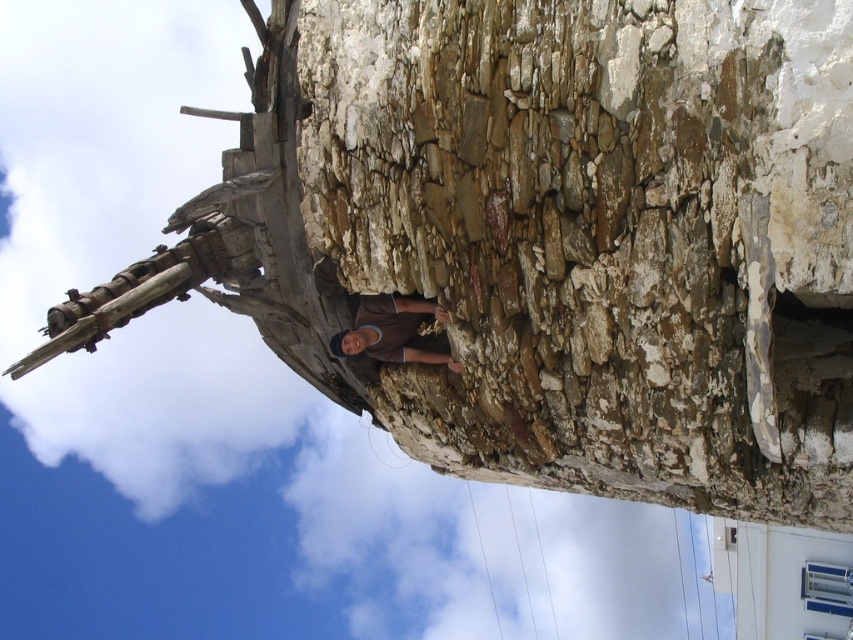
Find the location of `rusty stone wall at center`. rusty stone wall at center is located at coordinates (601, 236).

Is point (387, 84) in front of point (456, 371)?

That is True.

This screenshot has height=640, width=853. Describe the element at coordinates (601, 236) in the screenshot. I see `rusty stone wall at center` at that location.

Locate an element on the screen. rusty stone wall at center is located at coordinates (601, 236).